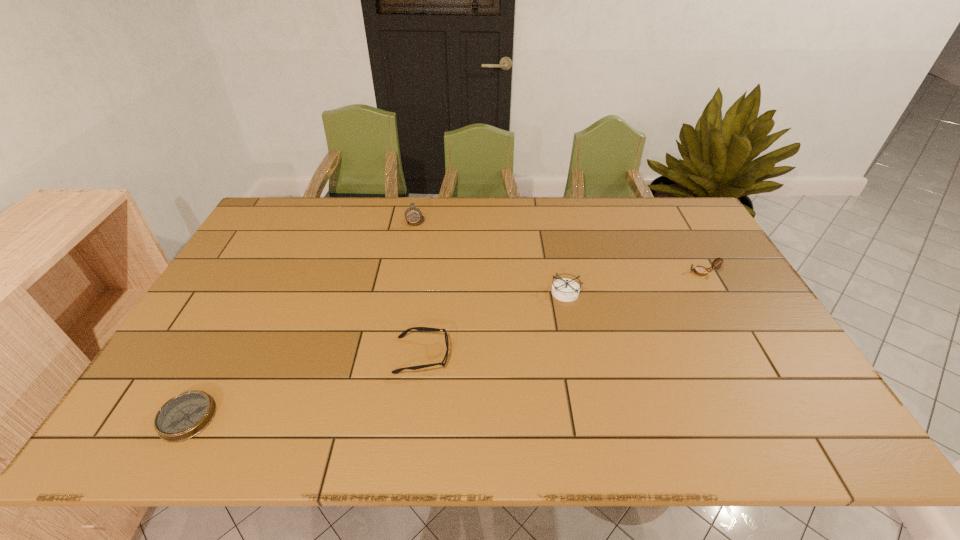
At what (x,y) coordinates should I click in order to perform the action: click on vacant position in the image that satisfies the following two spatial constraints: 1. on the face of the tallest object; 2. on the right side of the third farthest compass. Please return your answer as a coordinate pair (x, y). The image size is (960, 540). Looking at the image, I should click on (402, 292).